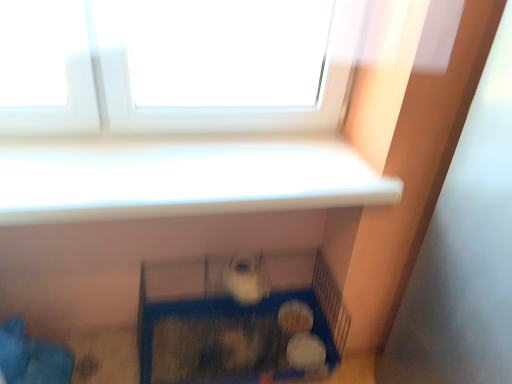
Question: Does white fur at center, placed as the 1th animal when sorted from front to back, have a greater width compared to blue plastic cage at lower center?

Choices:
 (A) yes
 (B) no

Answer: (B)

Question: Is white fur at center, placed as the 1th animal when sorted from front to back, facing away from blue plastic cage at lower center?

Choices:
 (A) yes
 (B) no

Answer: (B)

Question: Would you say white fur at center, placed as the 1th animal when sorted from front to back, contains blue plastic cage at lower center?

Choices:
 (A) no
 (B) yes

Answer: (A)

Question: From a real-world perspective, is white fur at center, which is the third animal in back-to-front order, over blue plastic cage at lower center?

Choices:
 (A) no
 (B) yes

Answer: (B)

Question: Is white fur at center, placed as the 1th animal when sorted from front to back, positioned before blue plastic cage at lower center?

Choices:
 (A) no
 (B) yes

Answer: (A)

Question: Is point (271, 327) positioned closer to the camera than point (305, 309)?

Choices:
 (A) farther
 (B) closer

Answer: (B)

Question: Is blue plastic cage at lower center taller or shorter than white fluffy ball at lower center, which appears as the 2th animal when ordered from the bottom?

Choices:
 (A) tall
 (B) short

Answer: (A)

Question: From a real-world perspective, is blue plastic cage at lower center above or below white fluffy ball at lower center, the first animal in the back-to-front sequence?

Choices:
 (A) below
 (B) above

Answer: (B)

Question: Considering the positions of blue plastic cage at lower center and white fluffy ball at lower center, which appears as the 2th animal when ordered from the bottom, in the image, is blue plastic cage at lower center wider or thinner than white fluffy ball at lower center, which appears as the 2th animal when ordered from the bottom,?

Choices:
 (A) thin
 (B) wide

Answer: (B)

Question: From the image's perspective, is white fur at center, which is the third animal in back-to-front order, above or below white fluffy ball at lower center, the third animal in the top-to-bottom sequence?

Choices:
 (A) below
 (B) above

Answer: (B)

Question: Is point (241, 288) positioned closer to the camera than point (302, 332)?

Choices:
 (A) closer
 (B) farther

Answer: (A)

Question: Is white fur at center, which is the third animal in back-to-front order, inside the boundaries of white fluffy ball at lower center, placed as the first animal when sorted from bottom to top, or outside?

Choices:
 (A) inside
 (B) outside

Answer: (B)

Question: From a real-world perspective, relative to white fluffy ball at lower center, placed as the first animal when sorted from bottom to top, is white fur at center, placed as the 1th animal when sorted from front to back, vertically above or below?

Choices:
 (A) below
 (B) above

Answer: (B)

Question: Would you say white fluffy ball at lower center, which ranks as the second animal in top-to-bottom order, is to the left or to the right of white fluffy ball at lower center, positioned as the second animal in front-to-back order, in the picture?

Choices:
 (A) left
 (B) right

Answer: (A)

Question: From the image's perspective, is white fluffy ball at lower center, which is counted as the 3th animal, starting from the front, above or below white fluffy ball at lower center, positioned as the second animal in front-to-back order?

Choices:
 (A) above
 (B) below

Answer: (A)